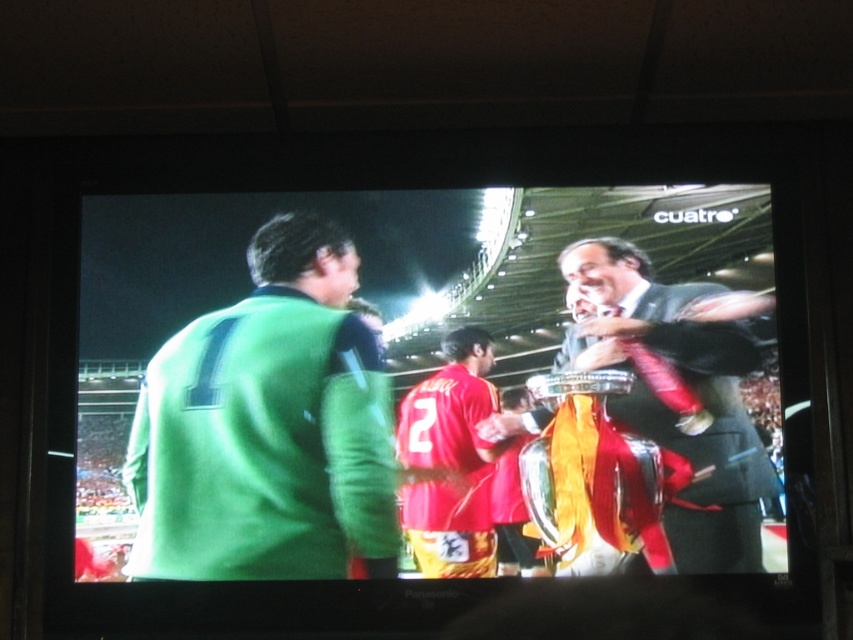
You are a sports commentator describing the scene. Where exactly is the green jersey at center located in terms of coordinates?

The green jersey at center is located at coordinates point (268,428).

You are a photographer at the stadium and want to capture a photo of both the green jersey at center and the red jersey at center in the same frame. Considering their heights, which jersey should you focus on first to ensure both are fully visible in the photo?

The green jersey at center is much taller than the red jersey at center. To ensure both are fully visible, focus on the green jersey at center first as it requires more vertical space in the frame.

You are a photographer at the sports event and need to capture a photo of the shiny black suit at center and the red jersey at center. Based on their positions, which one is more likely to be in the frame if you focus on the center of the image?

The shiny black suit at center is more likely to be in the frame because it is positioned at the center, while the red jersey at center might be slightly off to the side.